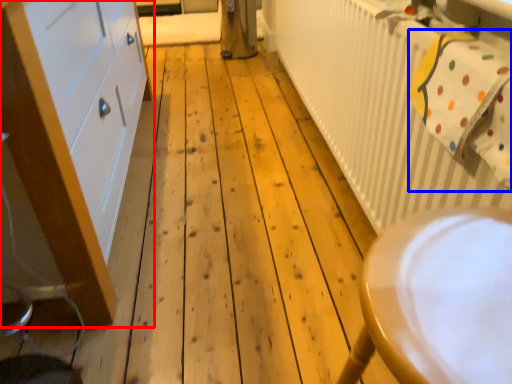
Question: Which object appears closest to the camera in this image, cabinetry (highlighted by a red box) or laundry (highlighted by a blue box)?

Choices:
 (A) cabinetry
 (B) laundry

Answer: (A)